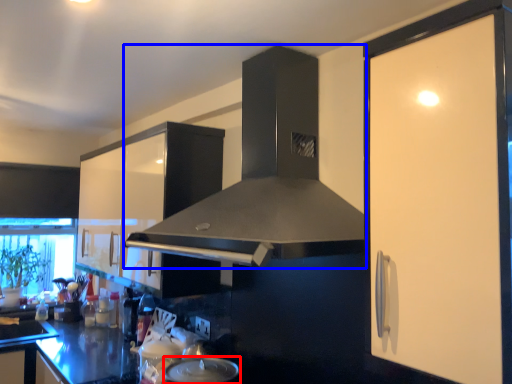
Question: Among these objects, which one is farthest to the camera, kitchen appliance (highlighted by a red box) or home appliance (highlighted by a blue box)?

Choices:
 (A) kitchen appliance
 (B) home appliance

Answer: (A)